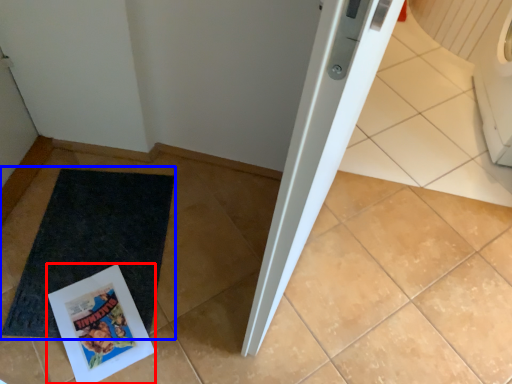
Question: Which object appears farthest to the camera in this image, comic book (highlighted by a red box) or mat (highlighted by a blue box)?

Choices:
 (A) comic book
 (B) mat

Answer: (B)